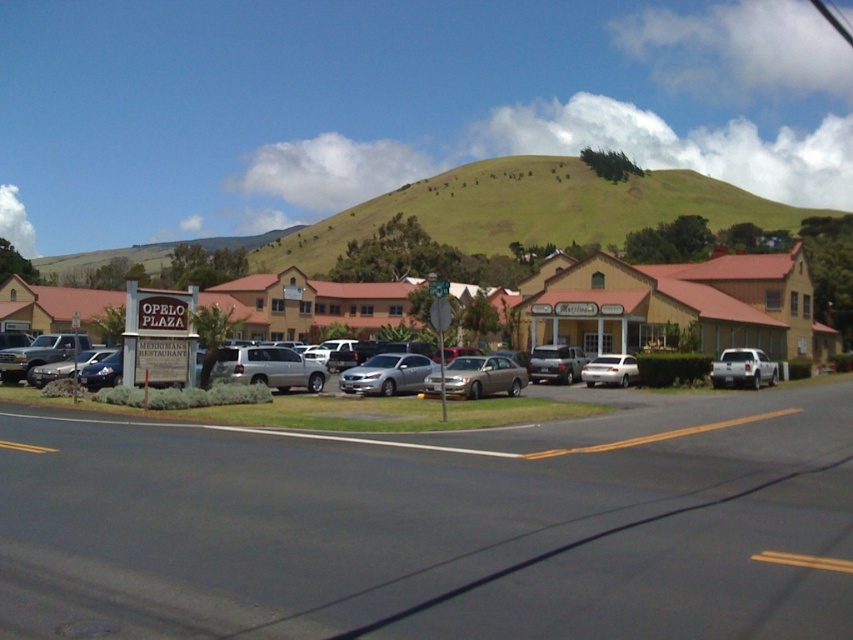
You are a delivery driver who needs to park your vehicle in the Opelo Plaza parking lot. You see a satin silver suv at center and a white matte sedan at center. Which vehicle should you avoid parking directly behind to ensure visibility for the driver behind you?

You should avoid parking directly behind the satin silver suv at center because it is closer to the viewer, meaning the white matte sedan at center is further back. Parking behind the SUV would block the view for the driver behind the SUV.

You are a delivery person who needs to park your vehicle in the Opelo Plaza parking lot. You see a satin silver suv at center and a white matte sedan at center. Which vehicle is parked closer to the entrance of the plaza?

The satin silver suv at center is parked closer to the entrance of the plaza because it is positioned above the white matte sedan at center, indicating it is nearer to the front.